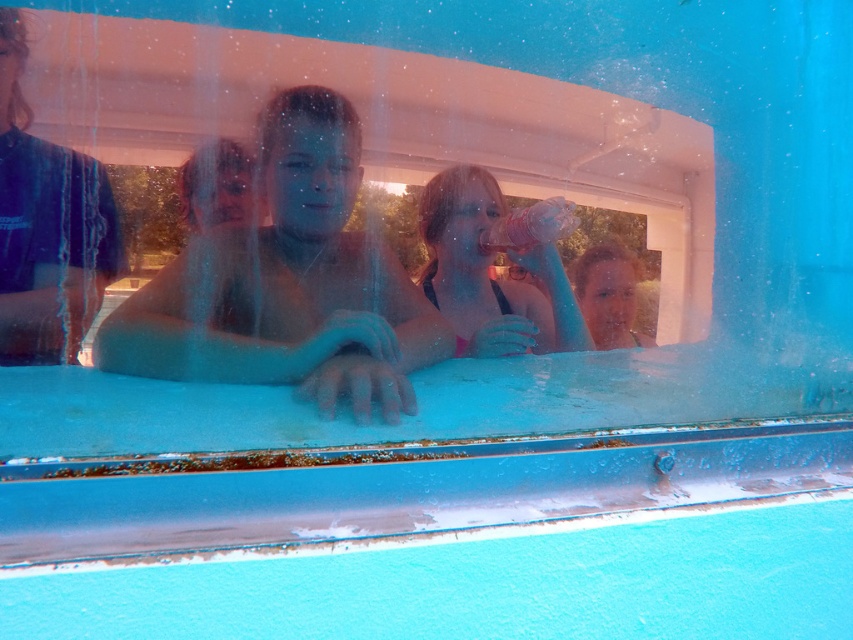
Does smooth skin boy at center have a greater height compared to pink fabric bikini top at center?

Indeed, smooth skin boy at center has a greater height compared to pink fabric bikini top at center.

Which of these two, smooth skin boy at center or pink fabric bikini top at center, stands shorter?

With less height is pink fabric bikini top at center.

What do you see at coordinates (287, 284) in the screenshot? I see `smooth skin boy at center` at bounding box center [287, 284].

You are a GUI agent. You are given a task and a screenshot of the screen. Output one action in this format:
    pyautogui.click(x=<x>, y=<y>)
    Task: Click on the smooth skin boy at center
    The height and width of the screenshot is (640, 853).
    Given the screenshot: What is the action you would take?
    pyautogui.click(x=287, y=284)